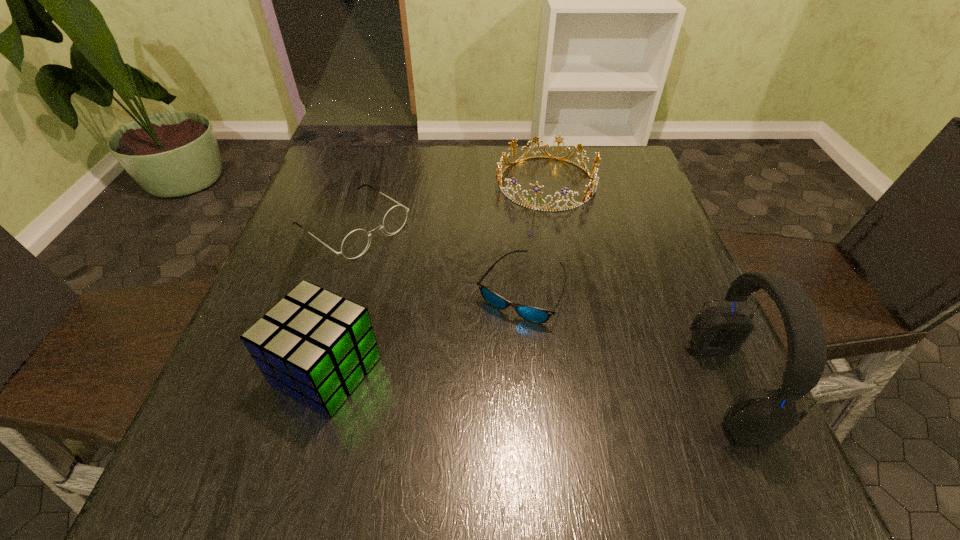
Identify the location of cube. The height and width of the screenshot is (540, 960). (316, 346).

Identify the location of the tallest object. Image resolution: width=960 pixels, height=540 pixels. (757, 417).

At what (x,y) coordinates should I click in order to perform the action: click on headset. Please return your answer as a coordinate pair (x, y). The width and height of the screenshot is (960, 540). Looking at the image, I should click on (757, 417).

Where is `tiara`? This screenshot has width=960, height=540. tiara is located at coordinates (594, 180).

This screenshot has height=540, width=960. In order to click on the second shortest object in this screenshot , I will do point(355,243).

Identify the location of sunglasses. The height and width of the screenshot is (540, 960). (533, 314).

This screenshot has width=960, height=540. What are the coordinates of `vacant region located 0.360m on the right of the cube` in the screenshot? It's located at (583, 370).

Identify the location of free space located on the front-facing side of the tiara. (513, 264).

Locate an element on the screen. vacant space located 0.350m on the front-facing side of the tiara is located at coordinates (490, 318).

This screenshot has width=960, height=540. Identify the location of vacant space positioned 0.170m on the front-facing side of the tiara. (515, 258).